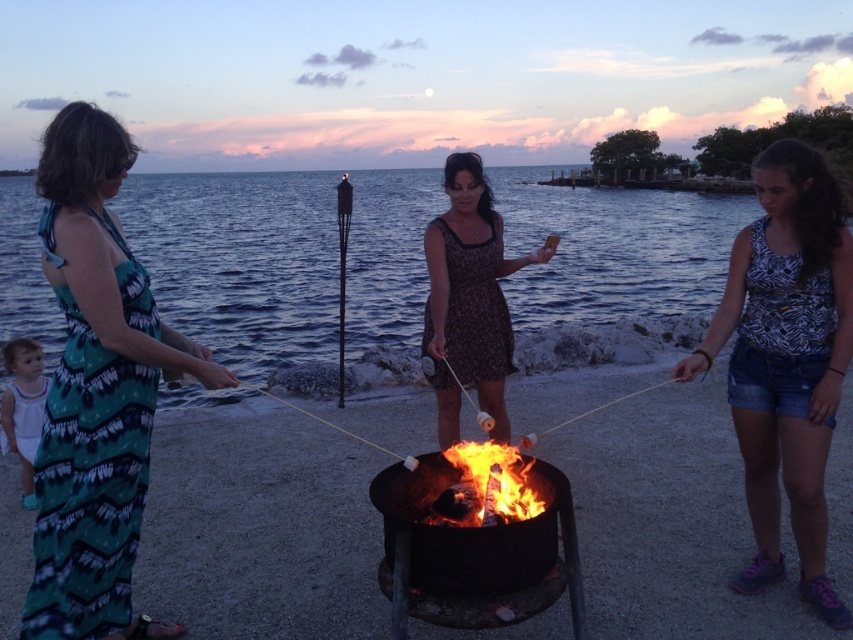
Question: Does brown floral dress at center have a larger size compared to flaming wood at center?

Choices:
 (A) no
 (B) yes

Answer: (B)

Question: Does flaming wood at center appear over white cotton dress at lower left?

Choices:
 (A) no
 (B) yes

Answer: (A)

Question: Estimate the real-world distances between objects in this image. Which object is farther from the black metal fire pit at center?

Choices:
 (A) blue water at center
 (B) flaming wood at center
 (C) teal printed dress at left
 (D) white cotton dress at lower left

Answer: (A)

Question: Which of the following is the closest to the observer?

Choices:
 (A) blue water at center
 (B) white cotton dress at lower left
 (C) black metal fire pit at center
 (D) brown floral dress at center

Answer: (C)

Question: Which of the following is the farthest from the observer?

Choices:
 (A) (502, 332)
 (B) (410, 369)
 (C) (71, 124)
 (D) (491, 444)

Answer: (B)

Question: Is denim shorts at right wider than black metal fire pit at center?

Choices:
 (A) no
 (B) yes

Answer: (A)